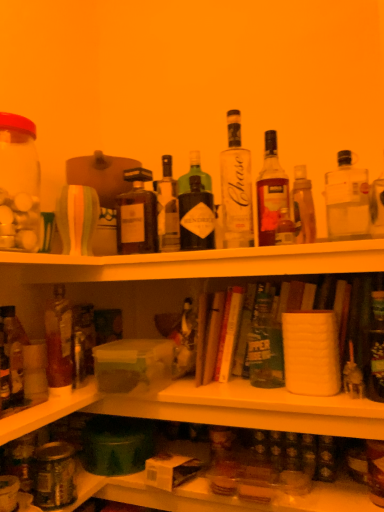
Question: Is matte glass jar at lower left touching matte glass bottle at center, which is the 8th bottle from right to left?

Choices:
 (A) no
 (B) yes

Answer: (A)

Question: Is matte glass jar at lower left positioned with its back to matte glass bottle at center, placed as the 3th bottle when sorted from left to right?

Choices:
 (A) yes
 (B) no

Answer: (B)

Question: From a real-world perspective, is matte glass jar at lower left located beneath matte glass bottle at center, which is the 8th bottle from right to left?

Choices:
 (A) no
 (B) yes

Answer: (B)

Question: From the image's perspective, is matte glass jar at lower left over matte glass bottle at center, which is the 8th bottle from right to left?

Choices:
 (A) yes
 (B) no

Answer: (B)

Question: Is matte glass jar at lower left taller than matte glass bottle at center, which is the 8th bottle from right to left?

Choices:
 (A) no
 (B) yes

Answer: (A)

Question: Considering the relative sizes of matte glass jar at lower left and matte glass bottle at center, placed as the 3th bottle when sorted from left to right, in the image provided, is matte glass jar at lower left shorter than matte glass bottle at center, placed as the 3th bottle when sorted from left to right,?

Choices:
 (A) yes
 (B) no

Answer: (A)

Question: Considering the relative sizes of clear glass bottle at upper right, acting as the second bottle starting from the right, and clear glass bottle at center, the sixth bottle when ordered from right to left, in the image provided, is clear glass bottle at upper right, acting as the second bottle starting from the right, shorter than clear glass bottle at center, the sixth bottle when ordered from right to left,?

Choices:
 (A) yes
 (B) no

Answer: (A)

Question: From a real-world perspective, does clear glass bottle at upper right, the ninth bottle positioned from the left, sit lower than clear glass bottle at center, positioned as the 5th bottle in left-to-right order?

Choices:
 (A) no
 (B) yes

Answer: (B)

Question: Is clear glass bottle at upper right, acting as the second bottle starting from the right, completely or partially outside of clear glass bottle at center, positioned as the 5th bottle in left-to-right order?

Choices:
 (A) no
 (B) yes

Answer: (B)

Question: Is clear glass bottle at upper right, the ninth bottle positioned from the left, oriented towards clear glass bottle at center, positioned as the 5th bottle in left-to-right order?

Choices:
 (A) yes
 (B) no

Answer: (B)

Question: Does clear glass bottle at upper right, the ninth bottle positioned from the left, appear on the left side of clear glass bottle at center, the sixth bottle when ordered from right to left?

Choices:
 (A) yes
 (B) no

Answer: (B)

Question: Considering the relative sizes of clear glass bottle at upper right, acting as the second bottle starting from the right, and clear glass bottle at center, positioned as the 5th bottle in left-to-right order, in the image provided, is clear glass bottle at upper right, acting as the second bottle starting from the right, wider than clear glass bottle at center, positioned as the 5th bottle in left-to-right order,?

Choices:
 (A) yes
 (B) no

Answer: (A)

Question: Considering the relative sizes of green matte beer bottle at center, placed as the 5th bottle when sorted from right to left, and translucent glass bottle at left, which appears as the tenth bottle when viewed from the right, in the image provided, is green matte beer bottle at center, placed as the 5th bottle when sorted from right to left, bigger than translucent glass bottle at left, which appears as the tenth bottle when viewed from the right,?

Choices:
 (A) no
 (B) yes

Answer: (B)